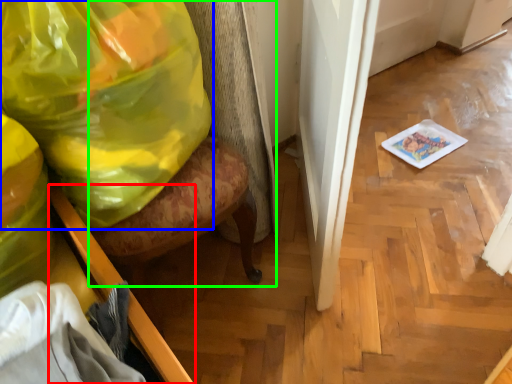
Question: Considering the real-world distances, which object is closest to furniture (highlighted by a red box)? plastic bag (highlighted by a blue box) or swivel chair (highlighted by a green box).

Choices:
 (A) plastic bag
 (B) swivel chair

Answer: (A)